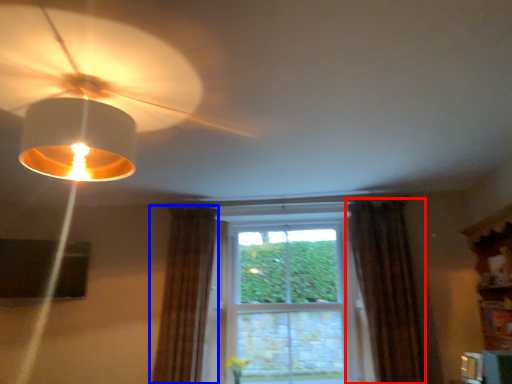
Question: Which of the following is the farthest to the observer, curtain (highlighted by a red box) or curtain (highlighted by a blue box)?

Choices:
 (A) curtain
 (B) curtain

Answer: (B)